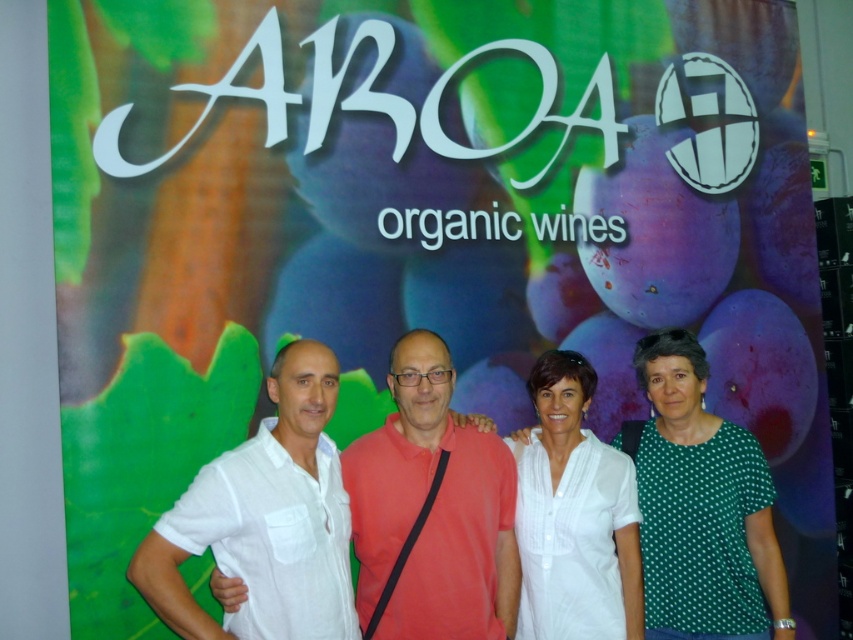
Question: Does white linen shirt at center have a smaller size compared to green dotted blouse at right?

Choices:
 (A) yes
 (B) no

Answer: (A)

Question: Which point is farther to the camera?

Choices:
 (A) (260, 481)
 (B) (666, 557)

Answer: (B)

Question: Is white linen shirt at center positioned behind white matte shirt at center?

Choices:
 (A) no
 (B) yes

Answer: (A)

Question: Which object is closer to the camera taking this photo?

Choices:
 (A) white matte shirt at center
 (B) green dotted blouse at right
 (C) matte red shirt at center
 (D) white linen shirt at center

Answer: (D)

Question: Which object is closer to the camera taking this photo?

Choices:
 (A) matte red shirt at center
 (B) green dotted blouse at right

Answer: (A)

Question: Is white linen shirt at center in front of white matte shirt at center?

Choices:
 (A) no
 (B) yes

Answer: (B)